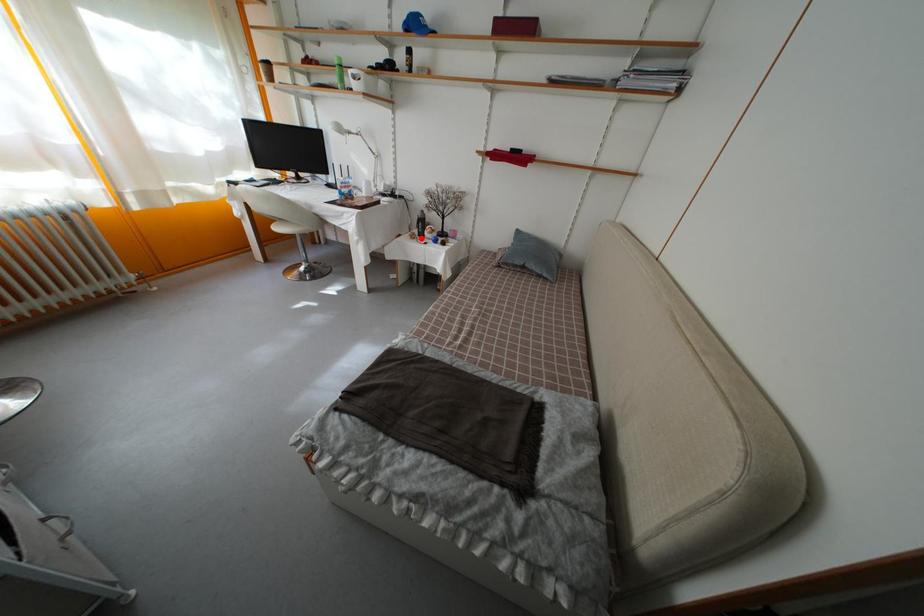
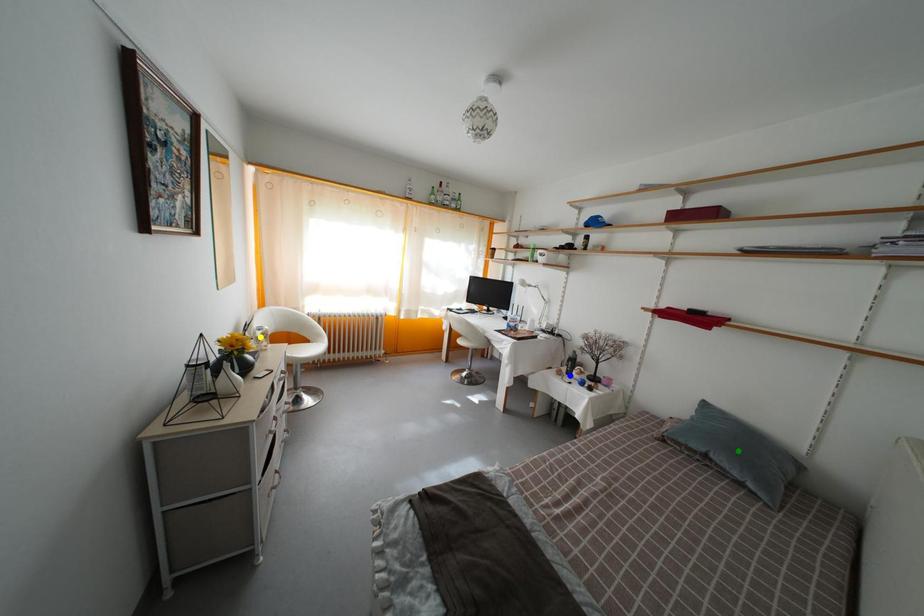
Question: I am providing you with two images of the same scene from different viewpoints. A red point is marked on the first image. You are given multiple points on the second image. In image 2, which mark is for the same physical point as the one in image 1?

Choices:
 (A) blue point
 (B) yellow point
 (C) green point

Answer: (A)